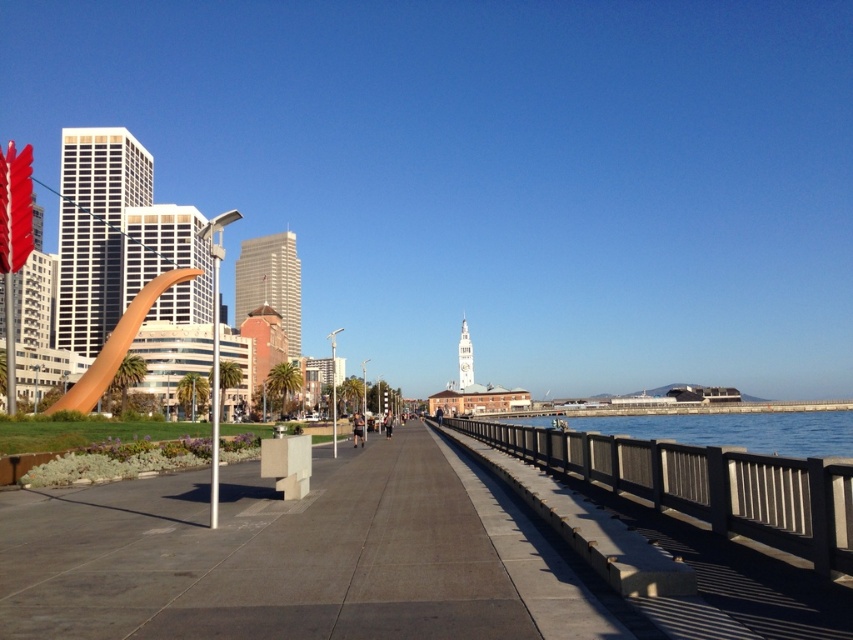
Is brown wooden rail at right smaller than clear blue water at right?

Correct, brown wooden rail at right occupies less space than clear blue water at right.

In the scene shown: Is brown wooden rail at right further to camera compared to clear blue water at right?

No, brown wooden rail at right is closer to the viewer.

Between point (596, 449) and point (645, 420), which one is positioned behind?

Positioned behind is point (645, 420).

At what (x,y) coordinates should I click in order to perform the action: click on brown wooden rail at right. Please return your answer as a coordinate pair (x, y). The image size is (853, 640). Looking at the image, I should click on (703, 484).